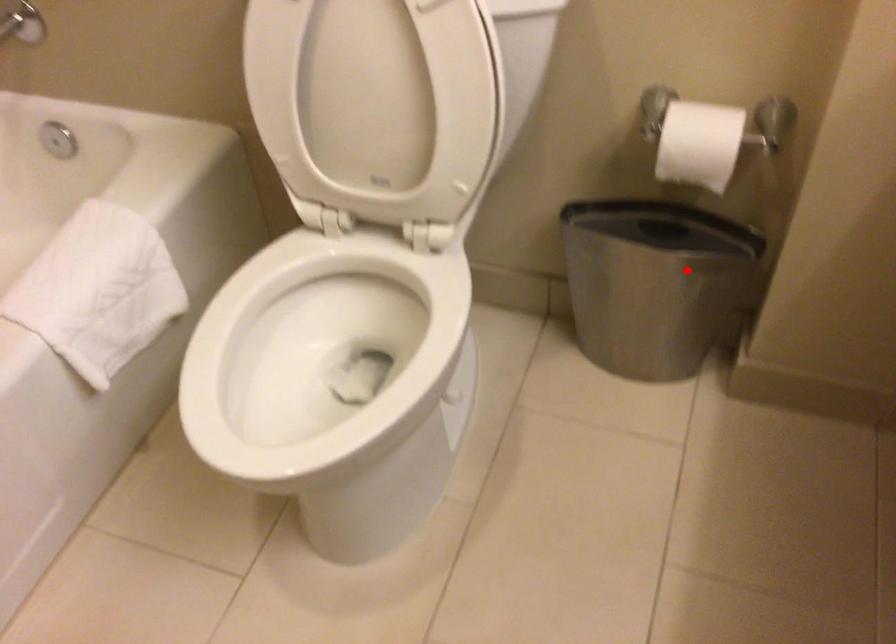
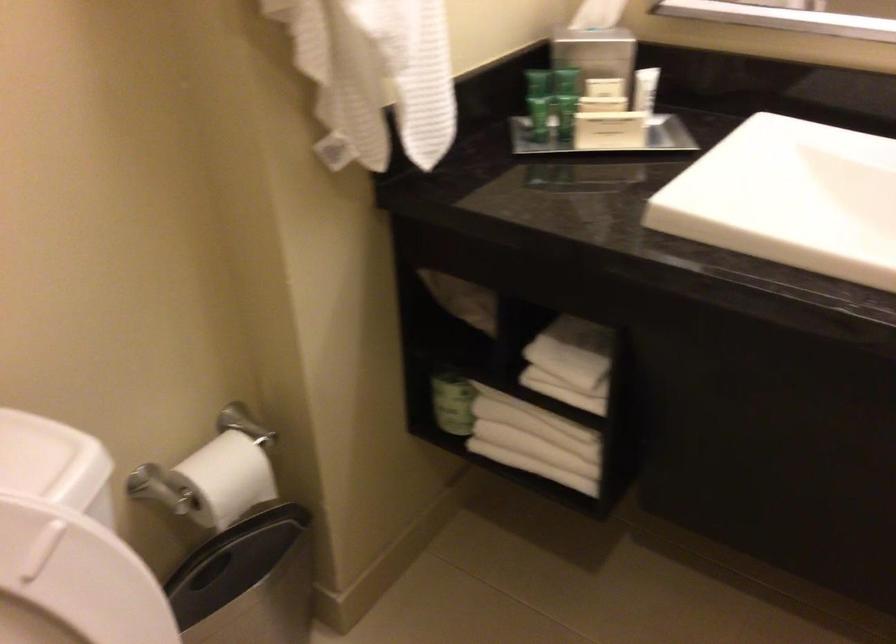
In the second image, find the point that corresponds to the highlighted location in the first image.

(247, 582)